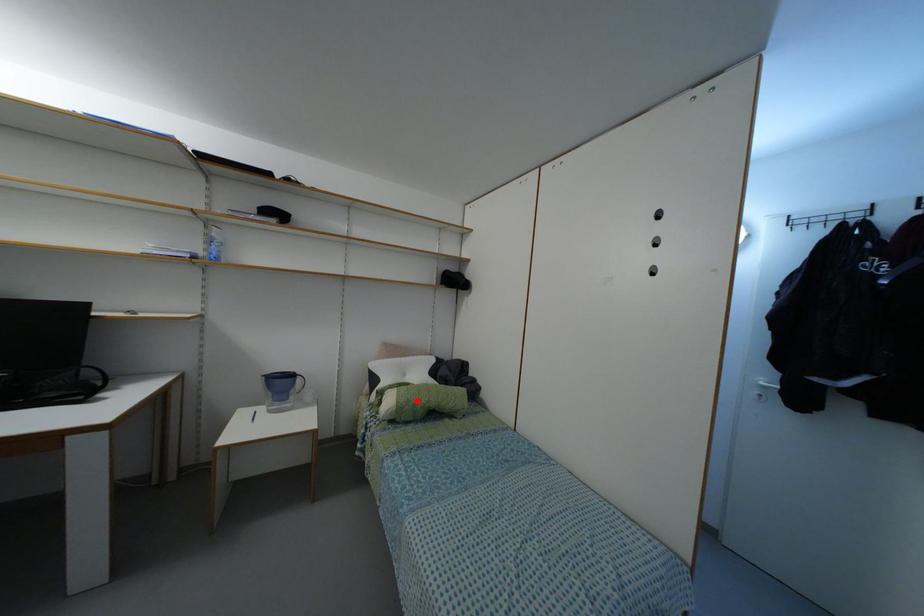
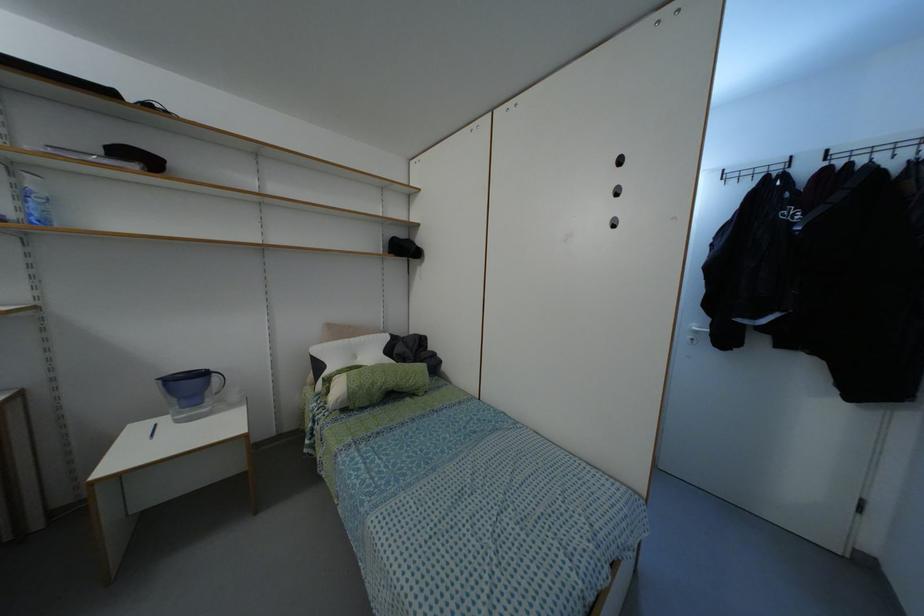
Find the pixel in the second image that matches the highlighted location in the first image.

(371, 384)